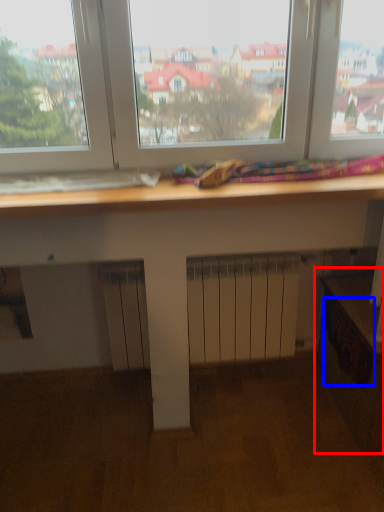
Question: Which point is further to the camera, workbench (highlighted by a red box) or drawer (highlighted by a blue box)?

Choices:
 (A) workbench
 (B) drawer

Answer: (B)